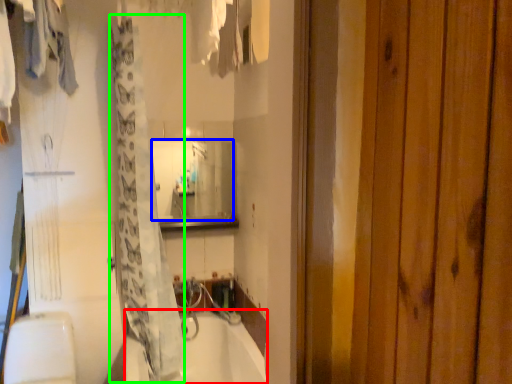
Question: Based on their relative distances, which object is nearer to bathtub (highlighted by a red box)? Choose from mirror (highlighted by a blue box) and shower curtain (highlighted by a green box).

Choices:
 (A) mirror
 (B) shower curtain

Answer: (B)